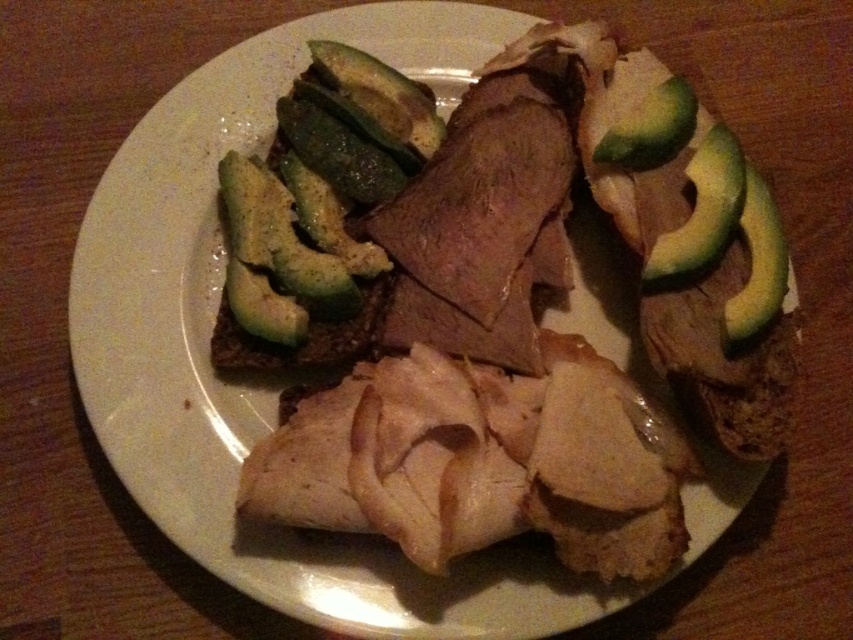
Question: Is the position of green smooth avocado at right more distant than that of green avocado at upper right?

Choices:
 (A) no
 (B) yes

Answer: (A)

Question: Which point appears closest to the camera in this image?

Choices:
 (A) (775, 296)
 (B) (339, 282)
 (C) (734, 161)

Answer: (A)

Question: Observing the image, what is the correct spatial positioning of green matte avocado at upper left in reference to green avocado at upper right?

Choices:
 (A) left
 (B) right

Answer: (A)

Question: Among these objects, which one is farthest from the camera?

Choices:
 (A) green avocado at upper right
 (B) green matte avocado at upper left
 (C) green smooth pickle at upper center
 (D) green smooth avocado at right

Answer: (C)

Question: Which point appears closest to the camera in this image?

Choices:
 (A) (608, 160)
 (B) (318, 259)
 (C) (375, 104)

Answer: (A)

Question: Does green matte avocado at upper left have a larger size compared to green avocado at upper right?

Choices:
 (A) no
 (B) yes

Answer: (B)